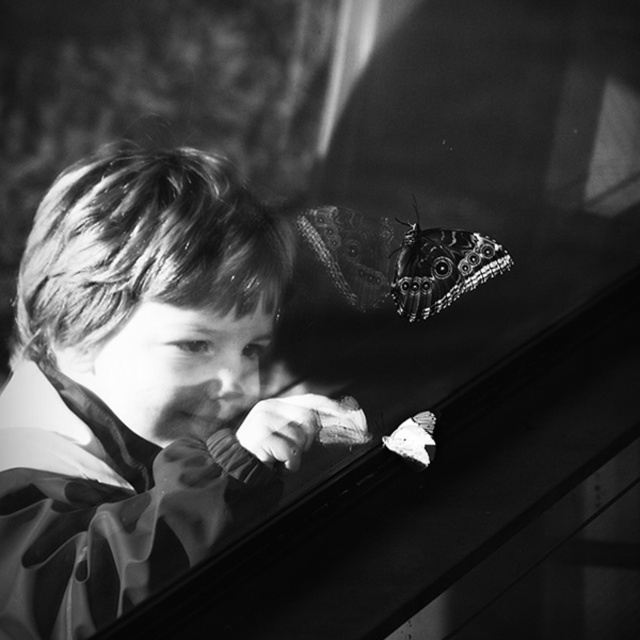
Does smooth fabric child at center have a larger size compared to patterned wing butterfly at upper right?

Yes, smooth fabric child at center is bigger than patterned wing butterfly at upper right.

Is point (236, 332) positioned in front of point (420, 308)?

That is True.

Find the location of a particular element. smooth fabric child at center is located at coordinates (138, 385).

Is patterned wing butterfly at upper right positioned behind white matte butterfly at lower right?

No.

Is patterned wing butterfly at upper right bigger than white matte butterfly at lower right?

Indeed, patterned wing butterfly at upper right has a larger size compared to white matte butterfly at lower right.

Who is more forward, [481,253] or [416,436]?

Point [481,253] is more forward.

Locate an element on the screen. The height and width of the screenshot is (640, 640). patterned wing butterfly at upper right is located at coordinates (440, 266).

Identify the location of smooth fabric child at center. The image size is (640, 640). tap(138, 385).

Who is more forward, (4, 484) or (420, 432)?

Positioned in front is point (4, 484).

You are a GUI agent. You are given a task and a screenshot of the screen. Output one action in this format:
    pyautogui.click(x=<x>, y=<y>)
    Task: Click on the smooth fabric child at center
    Image resolution: width=640 pixels, height=640 pixels.
    Given the screenshot: What is the action you would take?
    click(138, 385)